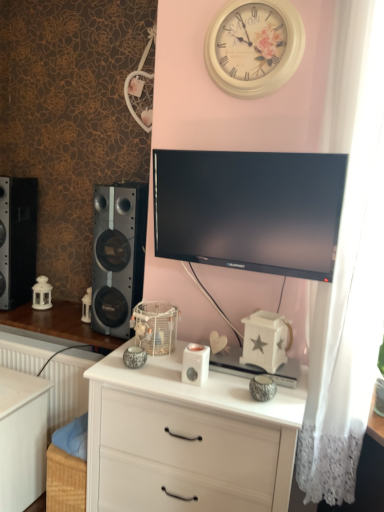
This screenshot has height=512, width=384. In order to click on free point to the right of white plastic ipod at center in this screenshot , I will do `click(223, 384)`.